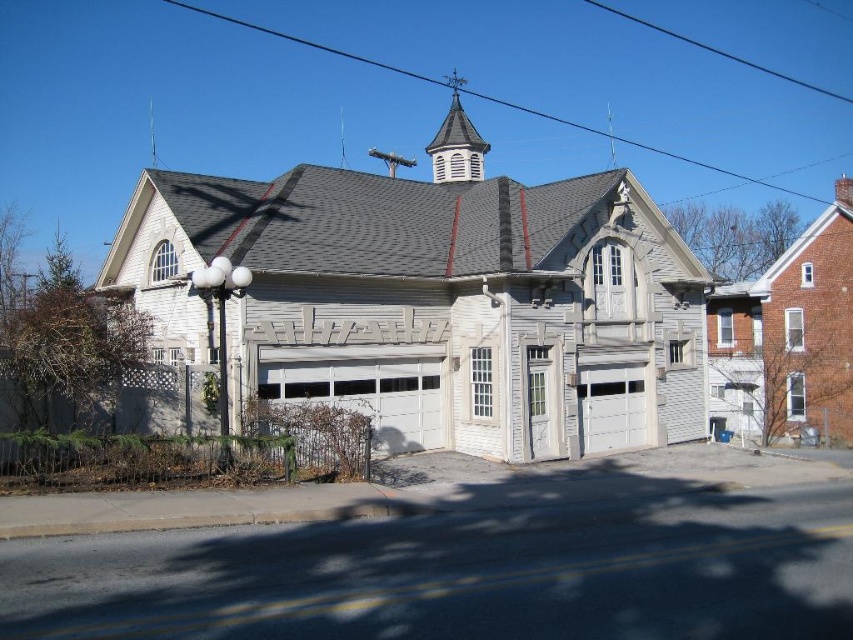
Consider the image. Is white painted wood garage door at center closer to camera compared to white smooth garage door at center?

Yes, white painted wood garage door at center is in front of white smooth garage door at center.

Where is `white painted wood garage door at center`? The image size is (853, 640). white painted wood garage door at center is located at coordinates (368, 394).

Measure the distance between white smooth garage door at center and camera.

white smooth garage door at center is 21.09 meters away from camera.

Who is more distant from viewer, (x=582, y=433) or (x=473, y=156)?

The point (x=473, y=156) is behind.

Locate an element on the screen. white smooth garage door at center is located at coordinates (611, 406).

Who is positioned more to the left, white wood church at center or white smooth garage door at center?

From the viewer's perspective, white wood church at center appears more on the left side.

Is point (465, 452) in front of point (590, 401)?

That is True.

Is point (625, 211) less distant than point (582, 426)?

No, (625, 211) is behind (582, 426).

Identify the location of white wood church at center. (427, 298).